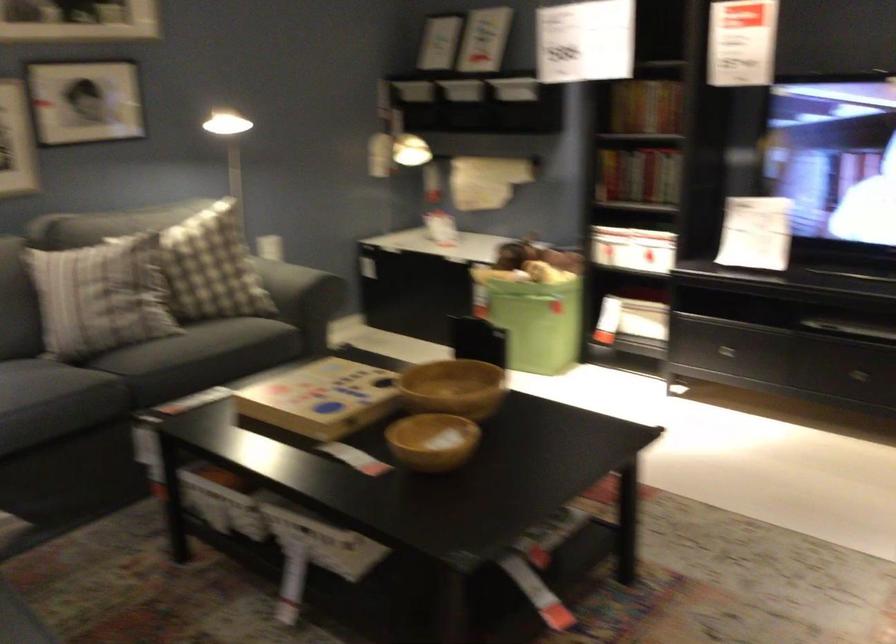
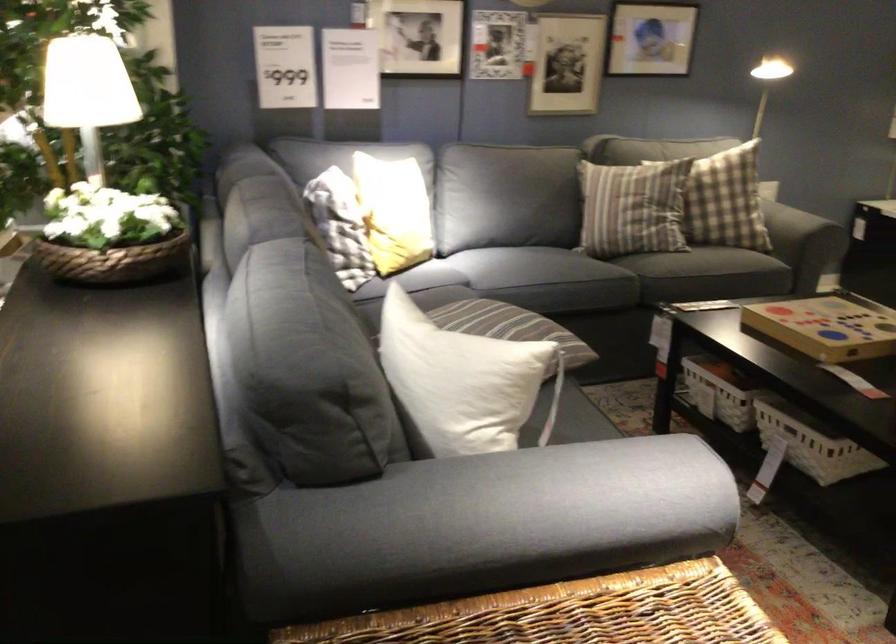
Locate, in the second image, the point that corresponds to [79,310] in the first image.

(633, 207)